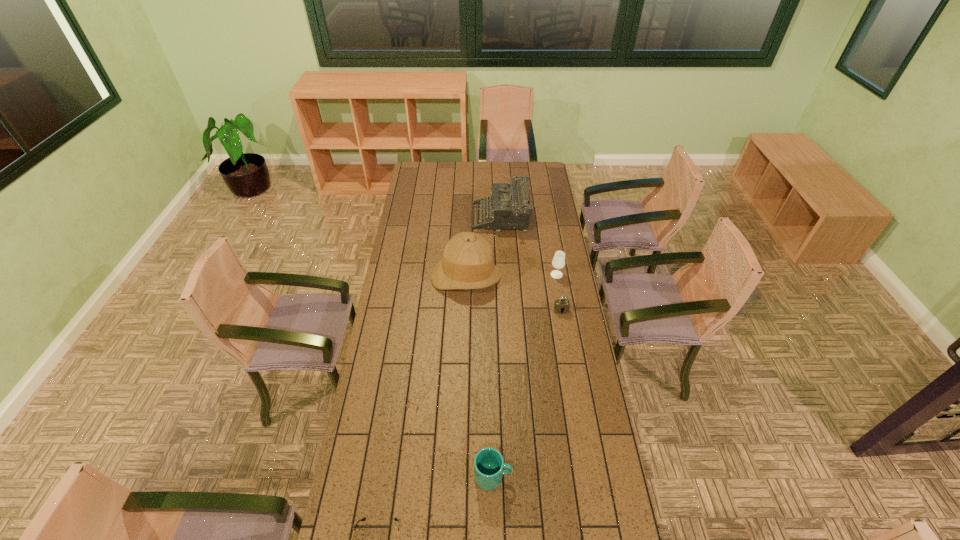
In the image, there is a desktop. At what (x,y) coordinates should I click in order to perform the action: click on vacant area at the right edge. Please return your answer as a coordinate pair (x, y). This screenshot has width=960, height=540. Looking at the image, I should click on (535, 223).

Find the location of a particular element. empty location between the padlock and the fourth tallest object is located at coordinates (527, 394).

Identify the location of vacant area that lies between the tallest object and the fifth farthest object. tap(479, 377).

Locate an element on the screen. This screenshot has width=960, height=540. free space between the glass and the hat is located at coordinates (512, 276).

Find the location of a particular element. free point between the second nearest object and the glass is located at coordinates (525, 375).

Locate an element on the screen. The height and width of the screenshot is (540, 960). empty space between the tallest object and the padlock is located at coordinates (514, 294).

Locate an element on the screen. The image size is (960, 540). free space between the fifth tallest object and the fifth farthest object is located at coordinates (527, 394).

Where is `free spot between the tallest object and the fifth farthest object`? free spot between the tallest object and the fifth farthest object is located at coordinates (479, 377).

At what (x,y) coordinates should I click in order to perform the action: click on free space between the glass and the hat. Please return your answer as a coordinate pair (x, y). The height and width of the screenshot is (540, 960). Looking at the image, I should click on (512, 276).

Identify the location of object that stands as the fourth closest to the fourth tallest object. This screenshot has height=540, width=960. (558, 262).